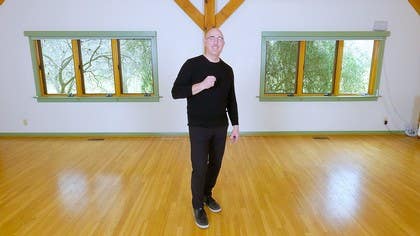
This screenshot has height=236, width=420. Find the location of `electrical cord`. electrical cord is located at coordinates (389, 130).